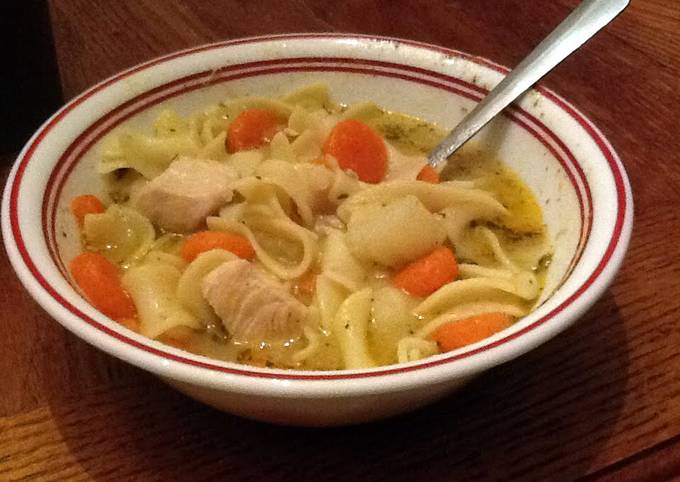
Where is `back edge of white bowl`? back edge of white bowl is located at coordinates click(x=277, y=44), click(x=430, y=56), click(x=333, y=44).